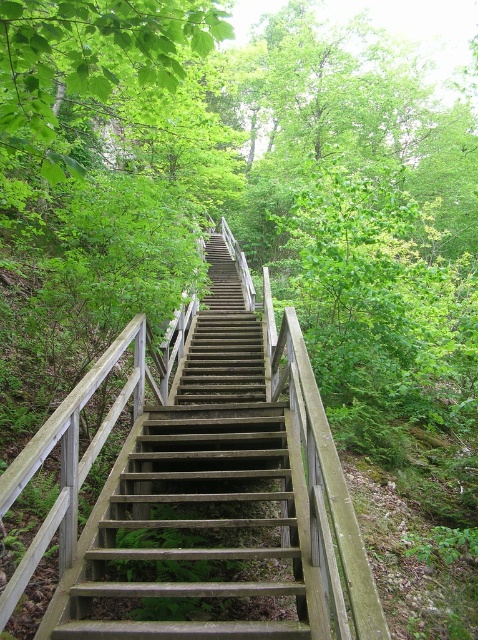
Question: Which of the following is the farthest from the observer?

Choices:
 (A) green leafy tree at upper left
 (B) wooden stairs at center

Answer: (B)

Question: Does wooden stairs at center have a lesser width compared to green leafy tree at upper left?

Choices:
 (A) no
 (B) yes

Answer: (B)

Question: Can you confirm if wooden stairs at center is bigger than green leafy tree at upper left?

Choices:
 (A) yes
 (B) no

Answer: (B)

Question: Among these points, which one is farthest from the camera?

Choices:
 (A) (33, 16)
 (B) (171, 445)

Answer: (B)

Question: Does wooden stairs at center appear under green leafy tree at upper left?

Choices:
 (A) no
 (B) yes

Answer: (B)